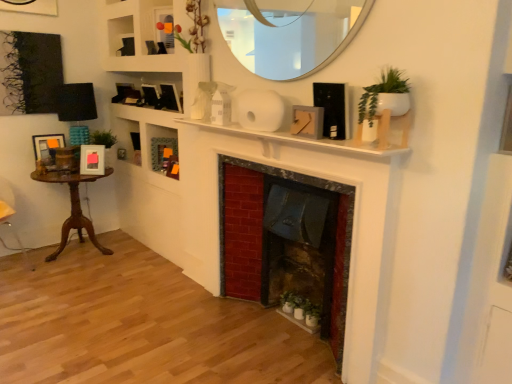
Question: Is green matte cabinet at center shorter than wooden picture frame at upper center, which appears as the fourth picture frame when viewed from the front?

Choices:
 (A) yes
 (B) no

Answer: (B)

Question: Does green matte cabinet at center appear on the right side of wooden picture frame at upper center, which appears as the fourth picture frame when viewed from the front?

Choices:
 (A) no
 (B) yes

Answer: (B)

Question: Is green matte cabinet at center thinner than wooden picture frame at upper center, which appears as the fourth picture frame when viewed from the front?

Choices:
 (A) yes
 (B) no

Answer: (A)

Question: From the image's perspective, is green matte cabinet at center on top of wooden picture frame at upper center, the third picture frame from the right?

Choices:
 (A) no
 (B) yes

Answer: (A)

Question: Is the depth of green matte cabinet at center less than that of wooden picture frame at upper center, marked as the second picture frame in a back-to-front arrangement?

Choices:
 (A) no
 (B) yes

Answer: (A)

Question: Is green matte cabinet at center far from wooden picture frame at upper center, the third picture frame from the right?

Choices:
 (A) yes
 (B) no

Answer: (B)

Question: From a real-world perspective, is wooden picture frame at left, arranged as the 5th picture frame when viewed from the right, on matte white picture frame at left, placed as the 3th picture frame when sorted from back to front?

Choices:
 (A) yes
 (B) no

Answer: (A)

Question: From the image's perspective, is wooden picture frame at left, which appears as the first picture frame when viewed from the left, located beneath matte white picture frame at left, placed as the 3th picture frame when sorted from back to front?

Choices:
 (A) no
 (B) yes

Answer: (A)

Question: From a real-world perspective, is wooden picture frame at left, which appears as the first picture frame when viewed from the left, below matte white picture frame at left, arranged as the fourth picture frame when viewed from the right?

Choices:
 (A) no
 (B) yes

Answer: (A)

Question: Are wooden picture frame at left, the first picture frame positioned from the back, and matte white picture frame at left, placed as the 3th picture frame when sorted from back to front, located far from each other?

Choices:
 (A) no
 (B) yes

Answer: (A)

Question: Is wooden picture frame at left, arranged as the 5th picture frame when viewed from the right, looking in the opposite direction of matte white picture frame at left, the second picture frame when ordered from left to right?

Choices:
 (A) yes
 (B) no

Answer: (B)

Question: Does wooden picture frame at left, the first picture frame positioned from the back, come in front of matte white picture frame at left, arranged as the fourth picture frame when viewed from the right?

Choices:
 (A) no
 (B) yes

Answer: (A)

Question: Does green matte cabinet at center appear on the right side of white matte fireplace at center?

Choices:
 (A) no
 (B) yes

Answer: (A)